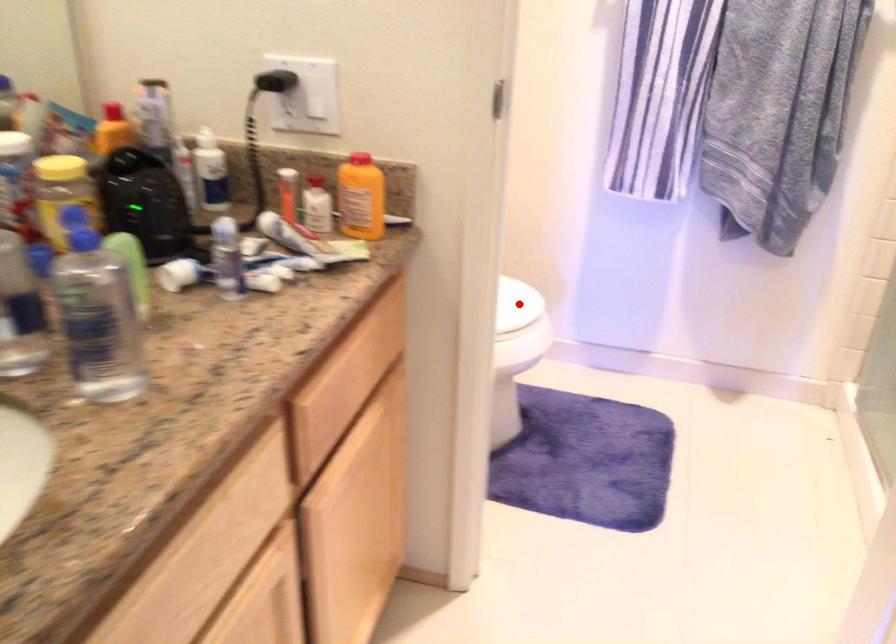
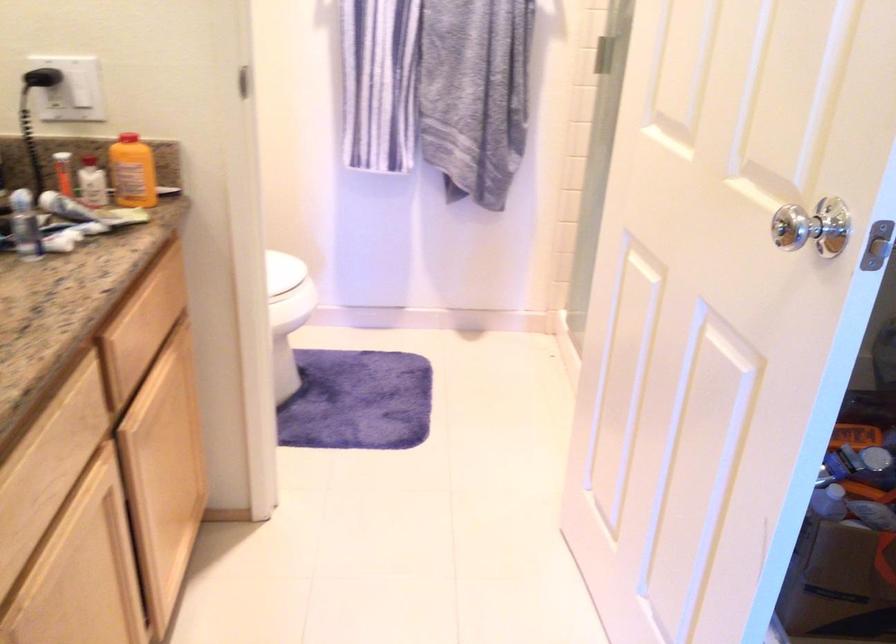
Where in the second image is the point corresponding to the highlighted location from the first image?

(282, 270)